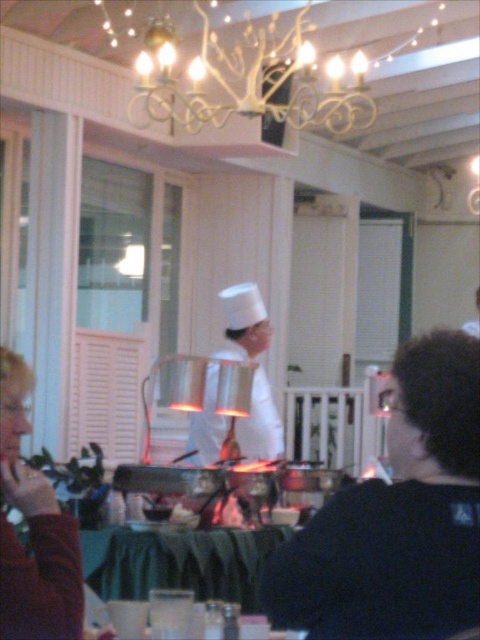
You are a customer entering the restaurant and see the white wrought iron chandelier at upper center and the matte red sweater at lower left. Which object is positioned higher in the image?

The white wrought iron chandelier at upper center is positioned higher in the image than the matte red sweater at lower left.

You are a customer sitting at the green fabric tablecloth at lower center in a busy restaurant. You notice the white wrought iron chandelier at upper center above you. Can you determine if the chandelier is directly above your table or shifted to one side?

The white wrought iron chandelier at upper center is positioned over the green fabric tablecloth at lower center, so it is directly above your table.